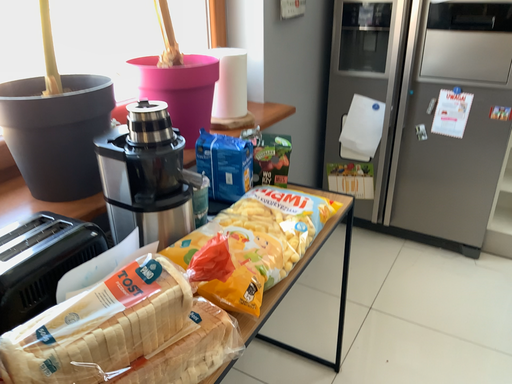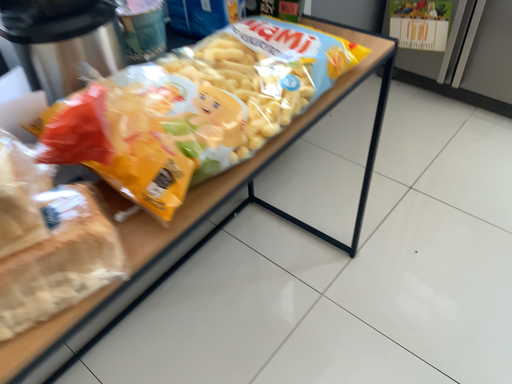
Question: How did the camera likely rotate when shooting the video?

Choices:
 (A) rotated downward
 (B) rotated upward

Answer: (A)